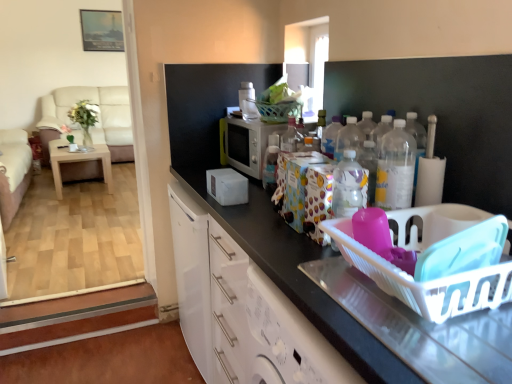
Question: Considering their positions, is beige fabric couch at left, arranged as the first couch when viewed from the front, located in front of or behind beige fabric couch at left, arranged as the first couch when viewed from the back?

Choices:
 (A) front
 (B) behind

Answer: (A)

Question: Is point (20, 132) positioned closer to the camera than point (65, 89)?

Choices:
 (A) farther
 (B) closer

Answer: (B)

Question: Considering the real-world distances, which object is farthest from the white glossy cabinet at center?

Choices:
 (A) clear plastic bottles at center-right
 (B) white glossy microwave at center, the second appliance when ordered from bottom to top
 (C) beige fabric couch at left, which is the second couch in back-to-front order
 (D) light brown wooden table at left
 (E) beige fabric couch at left, arranged as the first couch when viewed from the back

Answer: (E)

Question: Which object is positioned closest to the clear plastic bottles at center-right?

Choices:
 (A) transparent glass screen door at upper center
 (B) beige fabric couch at left, which is the second couch in back-to-front order
 (C) light brown wooden table at left
 (D) white glossy microwave at center, the second appliance when ordered from bottom to top
 (E) white plastic basket at right

Answer: (E)